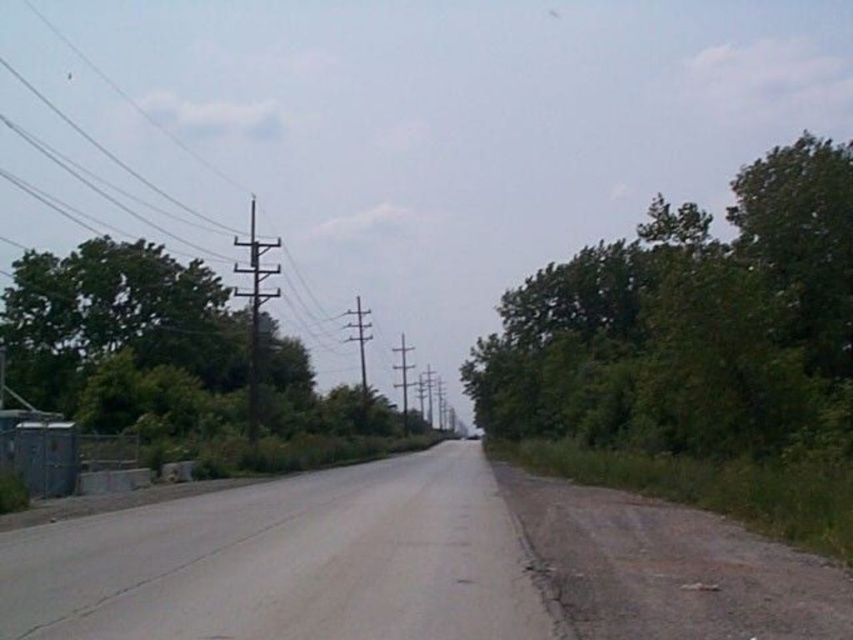
From the picture: Which is above, metallic gray telegraph pole at left or metallic gray telegraph pole at center?

metallic gray telegraph pole at left is above.

Can you confirm if metallic gray telegraph pole at left is taller than metallic gray telegraph pole at center?

Yes.

The image size is (853, 640). In order to click on metallic gray telegraph pole at left in this screenshot , I will do `click(254, 310)`.

Is green leafy tree at upper right positioned before smooth wood telegraph pole at center?

Yes, green leafy tree at upper right is closer to the viewer.

Which of these two, green leafy tree at upper right or smooth wood telegraph pole at center, stands taller?

green leafy tree at upper right

Which is behind, point (618, 404) or point (405, 413)?

Positioned behind is point (405, 413).

At what (x,y) coordinates should I click in order to perform the action: click on green leafy tree at upper right. Please return your answer as a coordinate pair (x, y). The height and width of the screenshot is (640, 853). Looking at the image, I should click on (689, 323).

Can you confirm if brown wooden utility pole at upper center is bigger than green leafy tree at left?

Correct, brown wooden utility pole at upper center is larger in size than green leafy tree at left.

Does brown wooden utility pole at upper center appear on the right side of green leafy tree at left?

In fact, brown wooden utility pole at upper center is to the left of green leafy tree at left.

The image size is (853, 640). What do you see at coordinates (196, 168) in the screenshot?
I see `brown wooden utility pole at upper center` at bounding box center [196, 168].

Image resolution: width=853 pixels, height=640 pixels. I want to click on brown wooden utility pole at upper center, so click(x=196, y=168).